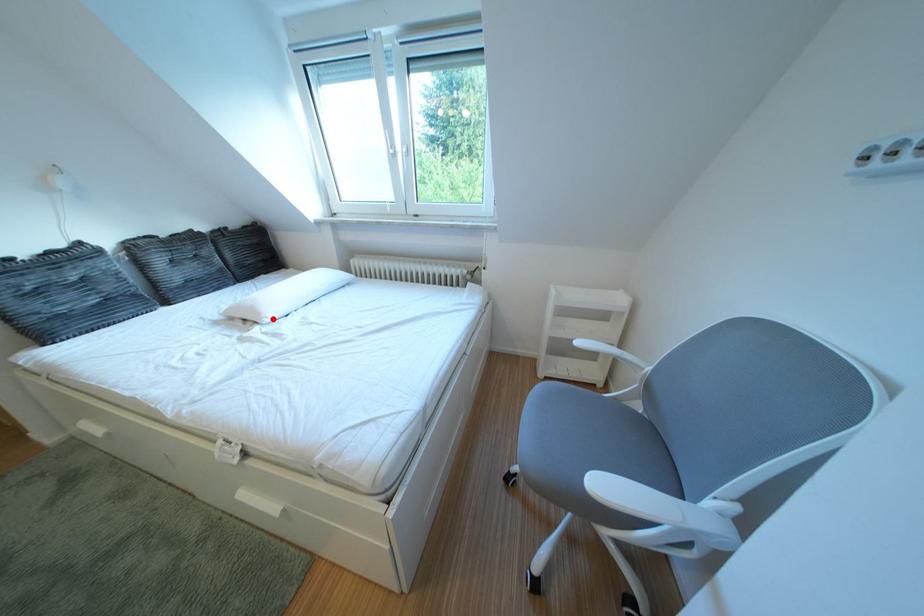
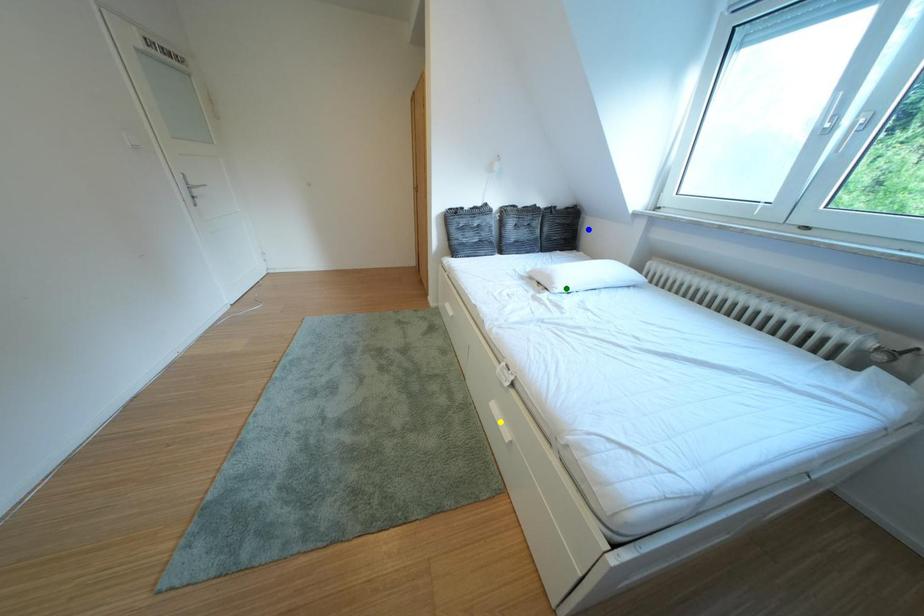
Question: I am providing you with two images of the same scene from different viewpoints. A red point is marked on the first image. You are given multiple points on the second image. Which spot in image 2 lines up with the point in image 1?

Choices:
 (A) yellow point
 (B) blue point
 (C) green point

Answer: (C)